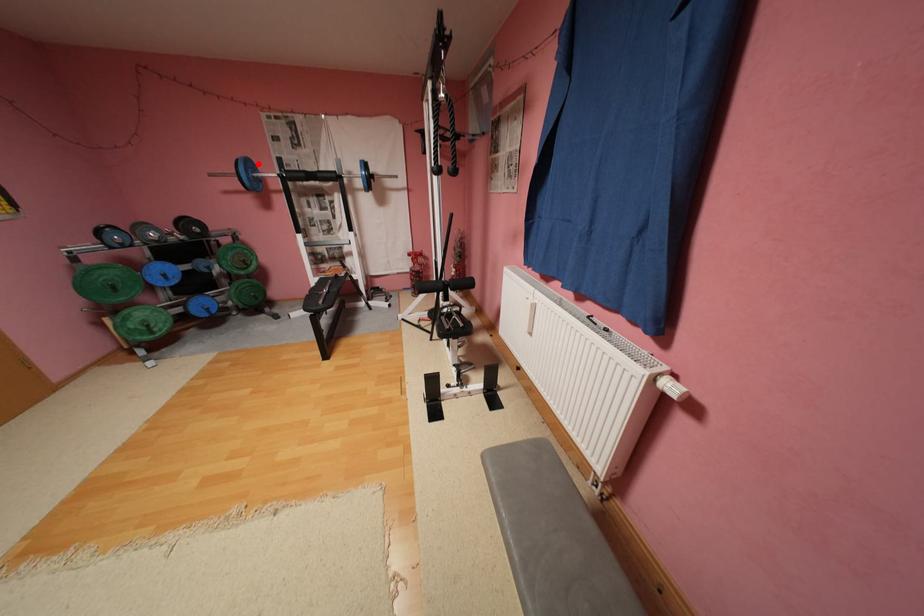
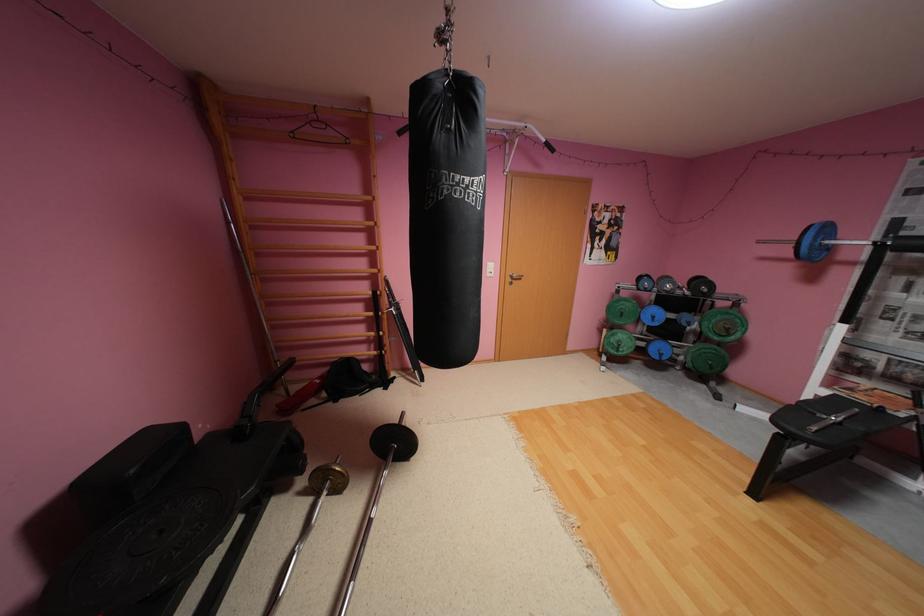
Question: A red point is marked in image1. In image2, is the corresponding 3D point closer to the camera or farther? Reply with the corresponding letter.

Choices:
 (A) The corresponding 3D point is closer.
 (B) The corresponding 3D point is farther.

Answer: (B)